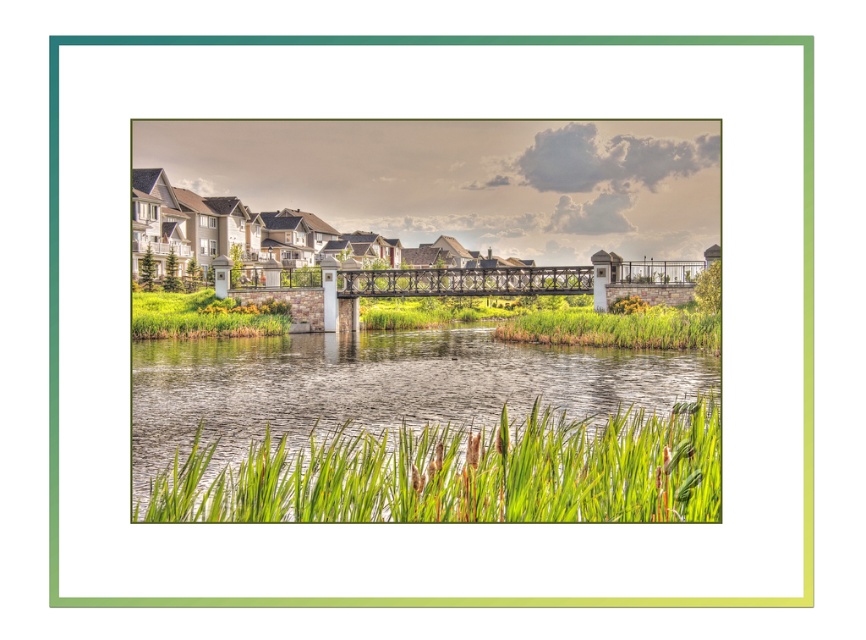
You are standing at the pedestrian bridge and want to walk towards the green grass at center. Which direction should you head relative to the green grass at lower left?

You should head to the right of the green grass at lower left to reach the green grass at center since the green grass at center is to the right of green grass at lower left.

You are a drone operator who needs to deliver a package from the green grass at center to the green grass at lower left. The drone has a maximum flight range of 35 meters. Can the drone make the delivery without needing to recharge?

The distance between the green grass at center and the green grass at lower left is 35.56 meters, which exceeds the drone s 35 meter range. The drone cannot make the delivery without recharging.

You are standing at the point with coordinates 0.4, 0.5 in the image. You want to walk to the metallic bridge at center. In which direction should you move?

You should move towards the northeast direction to reach the metallic bridge at center located at point (459, 282) from your current position at (433, 256).